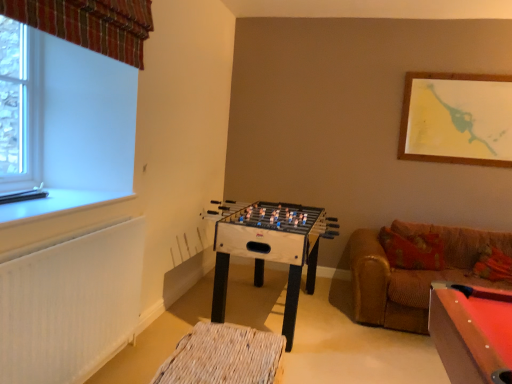
Question: Does point (75, 281) appear closer or farther from the camera than point (82, 31)?

Choices:
 (A) farther
 (B) closer

Answer: (B)

Question: Relative to plaid fabric curtain at upper left, is white textured radiator at lower left in front or behind?

Choices:
 (A) behind
 (B) front

Answer: (A)

Question: Considering the real-world distances, which object is farthest from the white plastic window sill at left?

Choices:
 (A) clear glass window at upper left
 (B) wooden foosball table at center
 (C) woven wood footrest at lower center
 (D) white textured radiator at lower left
 (E) plaid fabric curtain at upper left

Answer: (B)

Question: Which is nearer to the clear glass window at upper left?

Choices:
 (A) plaid fabric curtain at upper left
 (B) white textured radiator at lower left
 (C) brown leather couch at right
 (D) woven wood footrest at lower center
 (E) white plastic window sill at left

Answer: (E)